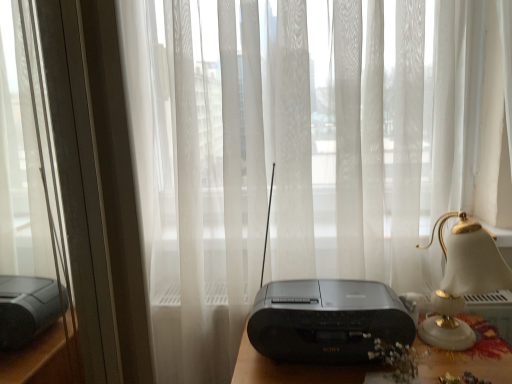
Question: Should I look upward or downward to see white glossy bedside lamp at right?

Choices:
 (A) down
 (B) up

Answer: (A)

Question: Considering the relative sizes of white glossy bedside lamp at right and black plastic radio at center in the image provided, is white glossy bedside lamp at right thinner than black plastic radio at center?

Choices:
 (A) yes
 (B) no

Answer: (A)

Question: Does white glossy bedside lamp at right touch black plastic radio at center?

Choices:
 (A) yes
 (B) no

Answer: (B)

Question: From the image's perspective, would you say white glossy bedside lamp at right is positioned over black plastic radio at center?

Choices:
 (A) yes
 (B) no

Answer: (A)

Question: Is white glossy bedside lamp at right positioned beyond the bounds of black plastic radio at center?

Choices:
 (A) no
 (B) yes

Answer: (B)

Question: Considering the relative sizes of white glossy bedside lamp at right and black plastic radio at center in the image provided, is white glossy bedside lamp at right bigger than black plastic radio at center?

Choices:
 (A) yes
 (B) no

Answer: (A)

Question: Is white glossy bedside lamp at right oriented away from black plastic radio at center?

Choices:
 (A) no
 (B) yes

Answer: (A)

Question: Does metallic silver window frame at left appear on the left side of black plastic radio at center?

Choices:
 (A) yes
 (B) no

Answer: (A)

Question: Could black plastic radio at center be considered to be inside metallic silver window frame at left?

Choices:
 (A) yes
 (B) no

Answer: (B)

Question: Is metallic silver window frame at left closer to camera compared to black plastic radio at center?

Choices:
 (A) no
 (B) yes

Answer: (A)

Question: Considering the relative sizes of metallic silver window frame at left and black plastic radio at center in the image provided, is metallic silver window frame at left bigger than black plastic radio at center?

Choices:
 (A) no
 (B) yes

Answer: (B)

Question: Does metallic silver window frame at left have a lesser width compared to black plastic radio at center?

Choices:
 (A) no
 (B) yes

Answer: (A)

Question: From the image's perspective, is metallic silver window frame at left under black plastic radio at center?

Choices:
 (A) no
 (B) yes

Answer: (A)

Question: Are black plastic radio at center and black plastic radio at center located far from each other?

Choices:
 (A) no
 (B) yes

Answer: (A)